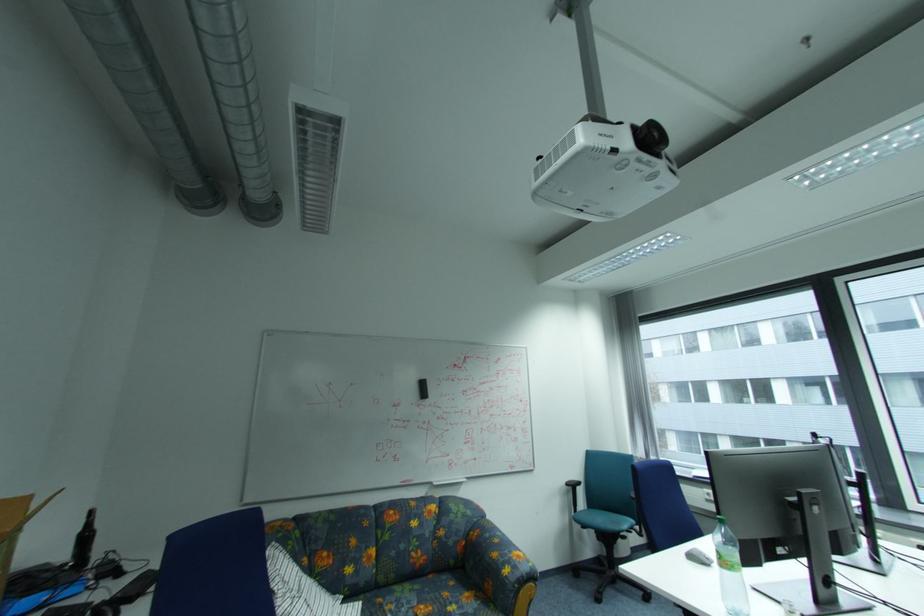
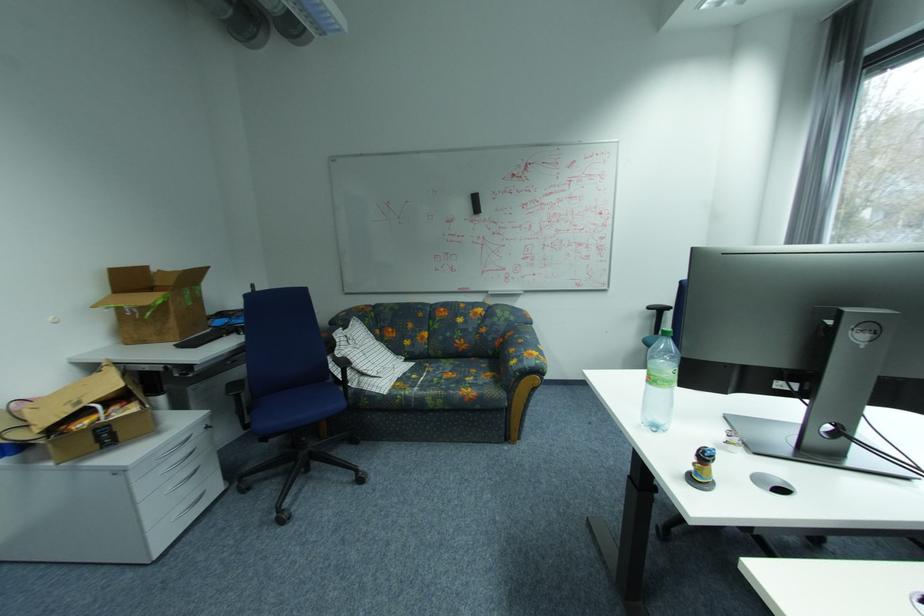
The point at (736, 562) is marked in the first image. Where is the corresponding point in the second image?

(661, 379)